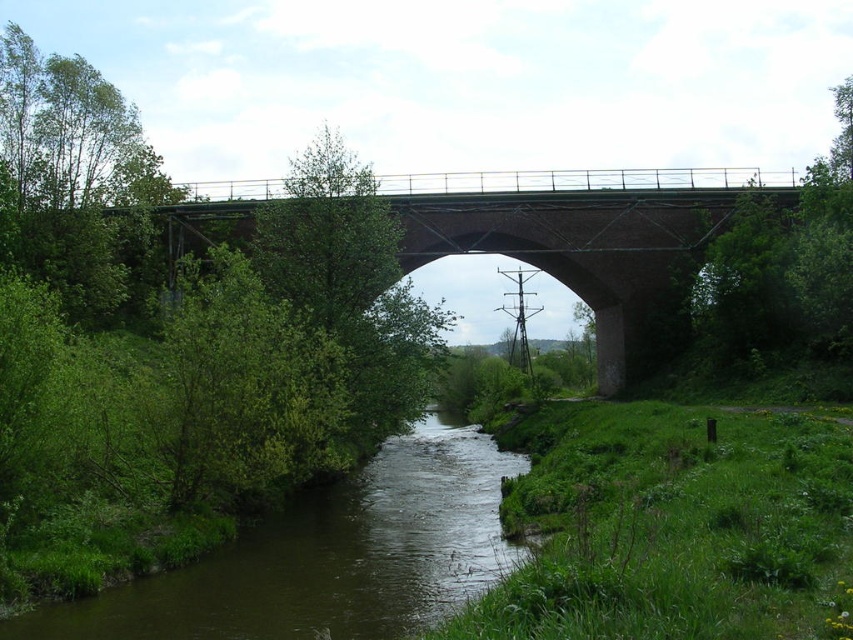
Question: Is green muddy stream at center below brick/concrete bridge at center?

Choices:
 (A) no
 (B) yes

Answer: (B)

Question: Which point is farther from the camera taking this photo?

Choices:
 (A) (247, 608)
 (B) (593, 220)

Answer: (B)

Question: Observing the image, what is the correct spatial positioning of green muddy stream at center in reference to brick/concrete bridge at center?

Choices:
 (A) left
 (B) right

Answer: (B)

Question: Is green muddy stream at center below brick/concrete bridge at center?

Choices:
 (A) no
 (B) yes

Answer: (B)

Question: Which point is farther to the camera?

Choices:
 (A) green muddy stream at center
 (B) brick/concrete bridge at center

Answer: (B)